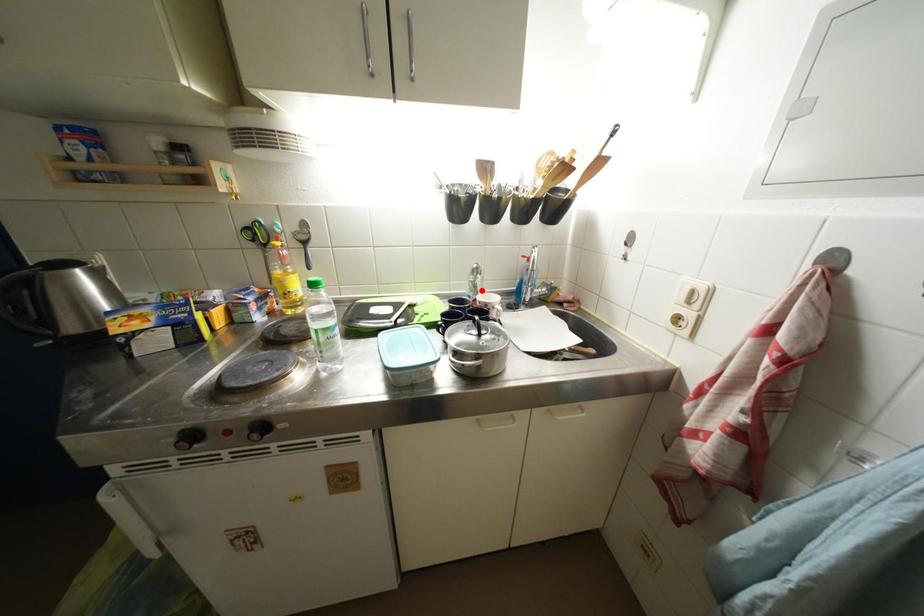
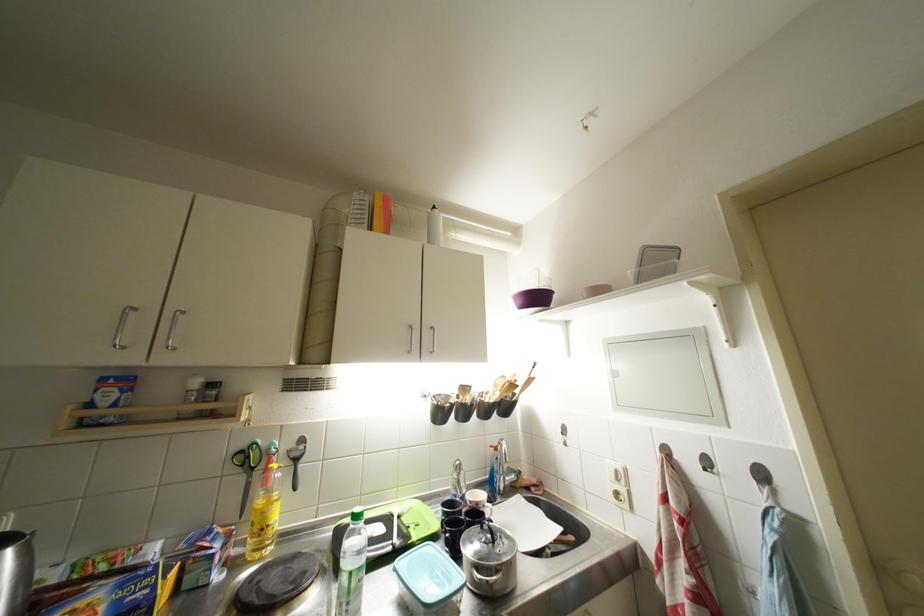
Locate, in the second image, the point that corresponds to the highlighted location in the first image.

(466, 487)